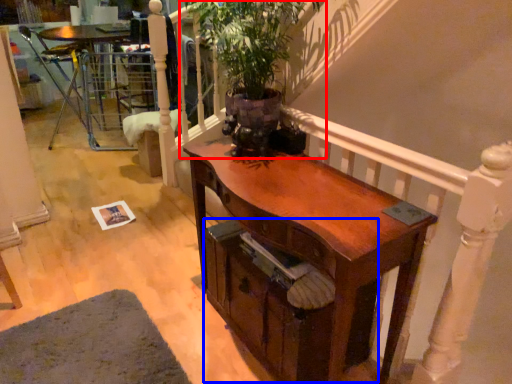
Question: Which object appears farthest to the camera in this image, houseplant (highlighted by a red box) or drawer (highlighted by a blue box)?

Choices:
 (A) houseplant
 (B) drawer

Answer: (B)